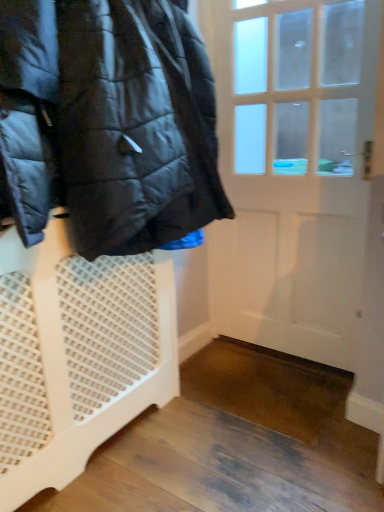
This screenshot has height=512, width=384. What are the coordinates of `white wooden door at center` in the screenshot? It's located at (292, 169).

Image resolution: width=384 pixels, height=512 pixels. What do you see at coordinates (292, 169) in the screenshot? I see `white wooden door at center` at bounding box center [292, 169].

Locate an element on the screen. white mesh laundry basket at left is located at coordinates (77, 355).

Locate an element on the screen. This screenshot has height=512, width=384. glossy black jacket at left is located at coordinates (107, 123).

Relative to glossy black jacket at left, is white mesh laundry basket at left in front or behind?

Visually, white mesh laundry basket at left is located behind glossy black jacket at left.

Is white mesh laundry basket at left not close to glossy black jacket at left?

Actually, white mesh laundry basket at left and glossy black jacket at left are a little close together.

Does white mesh laundry basket at left have a lesser width compared to glossy black jacket at left?

Yes, white mesh laundry basket at left is thinner than glossy black jacket at left.

Which object is closer to the camera, glossy black jacket at left or white mesh laundry basket at left?

glossy black jacket at left.

From the image's perspective, would you say glossy black jacket at left is positioned over white mesh laundry basket at left?

Indeed, from the image's perspective, glossy black jacket at left is shown above white mesh laundry basket at left.

Does glossy black jacket at left appear on the left side of white mesh laundry basket at left?

Incorrect, glossy black jacket at left is not on the left side of white mesh laundry basket at left.

Who is smaller, glossy black jacket at left or white mesh laundry basket at left?

Smaller between the two is white mesh laundry basket at left.

Is white mesh laundry basket at left thinner than white wooden door at center?

No, white mesh laundry basket at left is not thinner than white wooden door at center.

Is white mesh laundry basket at left oriented towards white wooden door at center?

No, white mesh laundry basket at left is not facing towards white wooden door at center.

Image resolution: width=384 pixels, height=512 pixels. I want to click on door behind the white mesh laundry basket at left, so click(292, 169).

Identify the location of jacket located above the white wooden door at center (from a real-world perspective). This screenshot has width=384, height=512. (107, 123).

From the image's perspective, which one is positioned higher, glossy black jacket at left or white wooden door at center?

glossy black jacket at left is shown above in the image.

Between glossy black jacket at left and white wooden door at center, which one has larger width?

Wider between the two is glossy black jacket at left.

Which is more to the right, glossy black jacket at left or white wooden door at center?

white wooden door at center is more to the right.

Considering the relative positions of white wooden door at center and white mesh laundry basket at left in the image provided, is white wooden door at center to the right of white mesh laundry basket at left from the viewer's perspective?

Yes, white wooden door at center is to the right of white mesh laundry basket at left.

In order to click on door above the white mesh laundry basket at left (from a real-world perspective) in this screenshot , I will do `click(292, 169)`.

Can white mesh laundry basket at left be found inside white wooden door at center?

No, white mesh laundry basket at left is not inside white wooden door at center.

Considering the sizes of objects white wooden door at center and white mesh laundry basket at left in the image provided, who is thinner, white wooden door at center or white mesh laundry basket at left?

Thinner between the two is white wooden door at center.

In the scene shown: Could glossy black jacket at left be considered to be inside white wooden door at center?

No, glossy black jacket at left is not surrounded by white wooden door at center.

Is white wooden door at center to the left of glossy black jacket at left from the viewer's perspective?

No.

From the image's perspective, is white wooden door at center located beneath glossy black jacket at left?

Yes, from the image's perspective, white wooden door at center is beneath glossy black jacket at left.

Identify the location of jacket on the left of white wooden door at center. The width and height of the screenshot is (384, 512). (107, 123).

The height and width of the screenshot is (512, 384). What are the coordinates of `furniture below the glossy black jacket at left (from a real-world perspective)` in the screenshot? It's located at (77, 355).

You are a GUI agent. You are given a task and a screenshot of the screen. Output one action in this format:
    pyautogui.click(x=<x>, y=<y>)
    Task: Click on the jacket located above the white mesh laundry basket at left (from a real-world perspective)
    
    Given the screenshot: What is the action you would take?
    pyautogui.click(x=107, y=123)

Based on their spatial positions, is glossy black jacket at left or white wooden door at center closer to white mesh laundry basket at left?

glossy black jacket at left lies closer to white mesh laundry basket at left than the other object.

From the image, which object appears to be farther from glossy black jacket at left, white mesh laundry basket at left or white wooden door at center?

white wooden door at center.

Which object lies further to the anchor point white wooden door at center, glossy black jacket at left or white mesh laundry basket at left?

The object further to white wooden door at center is white mesh laundry basket at left.

Which object lies further to the anchor point glossy black jacket at left, white wooden door at center or white mesh laundry basket at left?

white wooden door at center is positioned further to the anchor glossy black jacket at left.

Considering their positions, is white wooden door at center positioned closer to white mesh laundry basket at left than glossy black jacket at left?

glossy black jacket at left is closer to white mesh laundry basket at left.

Which object lies further to the anchor point white wooden door at center, white mesh laundry basket at left or glossy black jacket at left?

white mesh laundry basket at left lies further to white wooden door at center than the other object.

You are a GUI agent. You are given a task and a screenshot of the screen. Output one action in this format:
    pyautogui.click(x=<x>, y=<y>)
    Task: Click on the furniture between glossy black jacket at left and white wooden door at center from front to back
    The width and height of the screenshot is (384, 512).
    Given the screenshot: What is the action you would take?
    pyautogui.click(x=77, y=355)